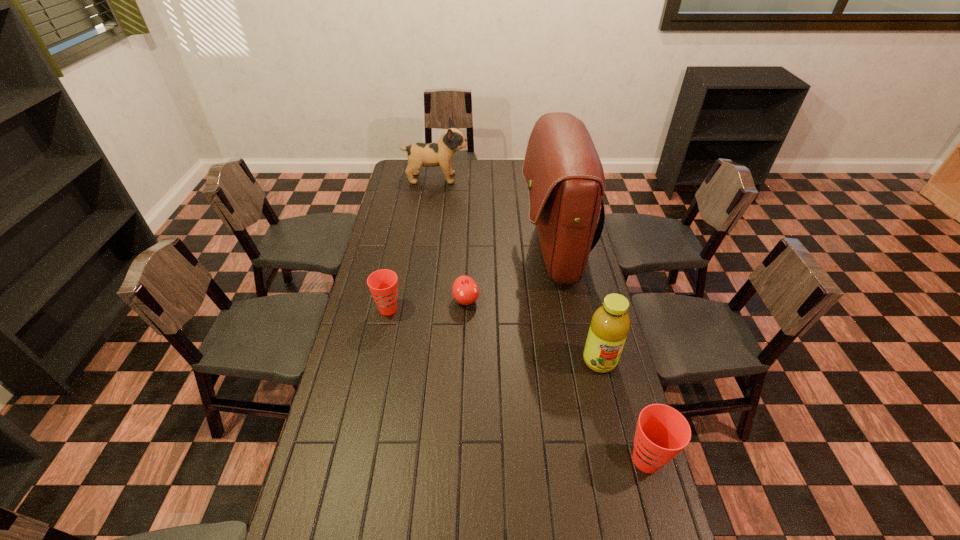
You are a GUI agent. You are given a task and a screenshot of the screen. Output one action in this format:
    pyautogui.click(x=<x>, y=<y>)
    Task: Click on the farther cup
    
    Given the screenshot: What is the action you would take?
    (x=383, y=284)

Locate an element on the screen. The width and height of the screenshot is (960, 540). the shorter cup is located at coordinates (383, 284).

Find the location of `the fourth tallest object`. the fourth tallest object is located at coordinates (662, 432).

Identify the location of the right cup. This screenshot has height=540, width=960. (662, 432).

The height and width of the screenshot is (540, 960). Identify the location of puppy. (440, 153).

Where is `the second nearest object`? the second nearest object is located at coordinates (610, 324).

Image resolution: width=960 pixels, height=540 pixels. Find the location of `satchel`. satchel is located at coordinates (564, 175).

Identify the location of apple. The width and height of the screenshot is (960, 540). (465, 290).

Find the location of a particular element. This screenshot has width=960, height=540. vacant space located on the back of the fifth tallest object is located at coordinates (396, 275).

In order to click on vacant space situated 0.100m on the back of the third shortest object in this screenshot , I will do `click(632, 407)`.